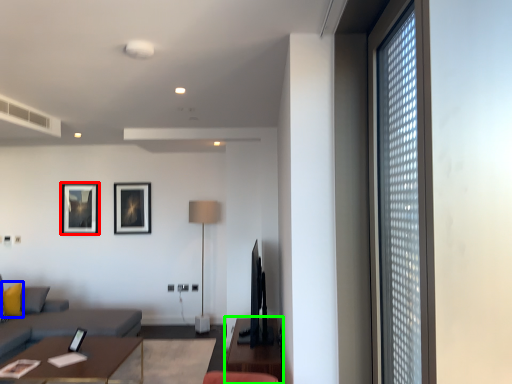
Question: Considering the real-world distances, which object is closest to picture frame (highlighted by a red box)? pillow (highlighted by a blue box) or table (highlighted by a green box).

Choices:
 (A) pillow
 (B) table

Answer: (A)